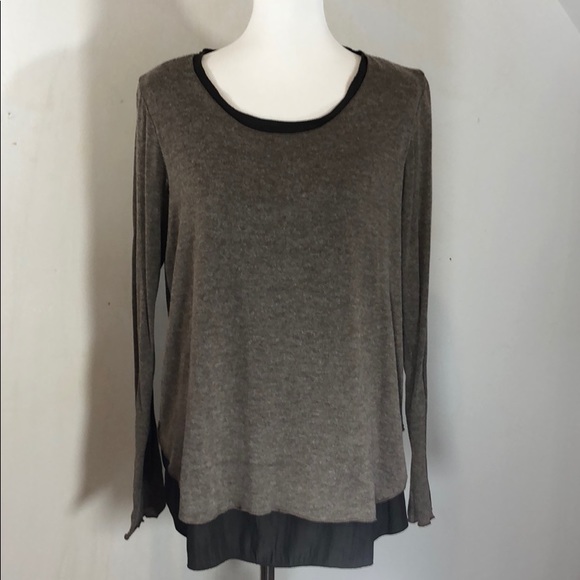
Where is `mannequin's support bar`? mannequin's support bar is located at coordinates (268, 569).